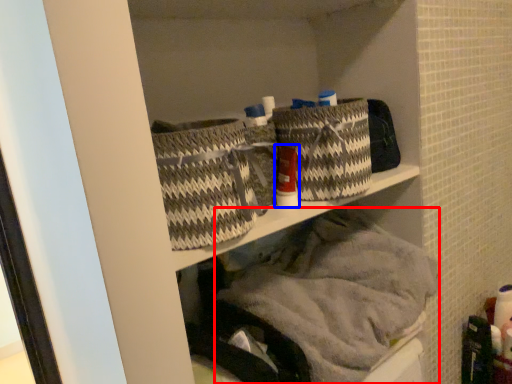
Question: Which point is further to the camera, material (highlighted by a red box) or toiletry (highlighted by a blue box)?

Choices:
 (A) material
 (B) toiletry

Answer: (B)